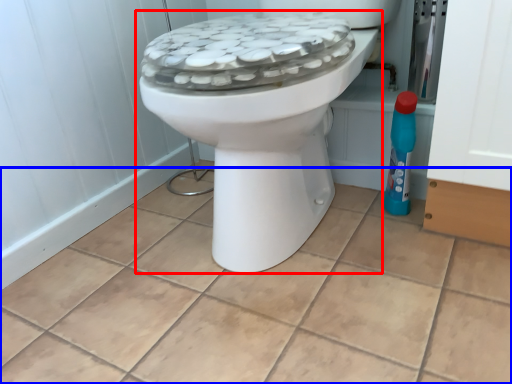
Question: Among these objects, which one is nearest to the camera, toilet (highlighted by a red box) or ceramic tile (highlighted by a blue box)?

Choices:
 (A) toilet
 (B) ceramic tile

Answer: (B)